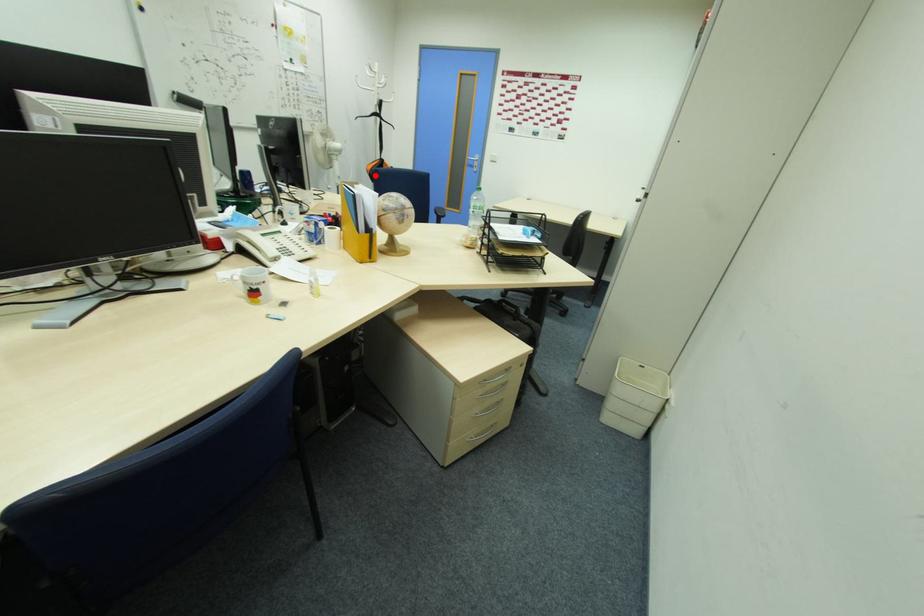
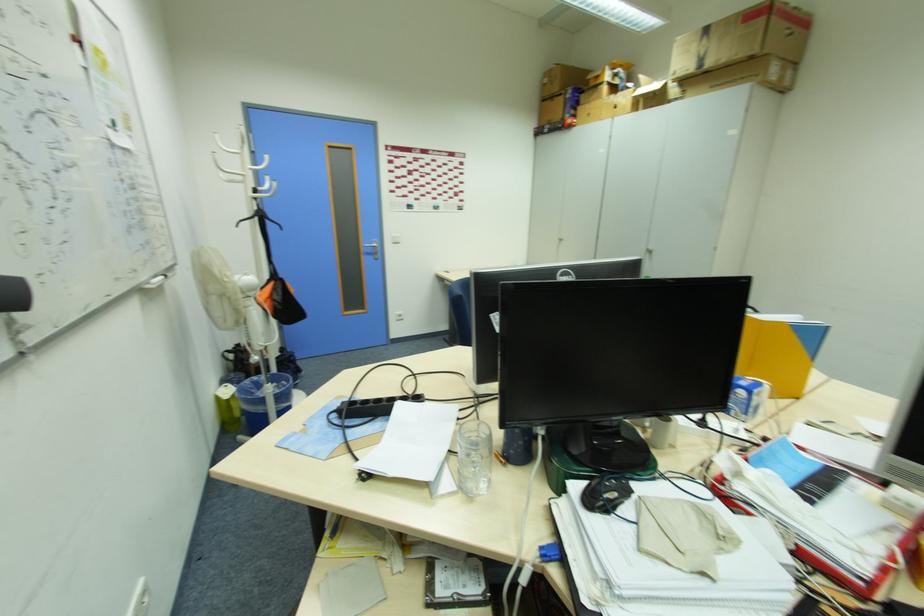
Find the pixel in the second image that matches the highlighted location in the first image.

(283, 309)